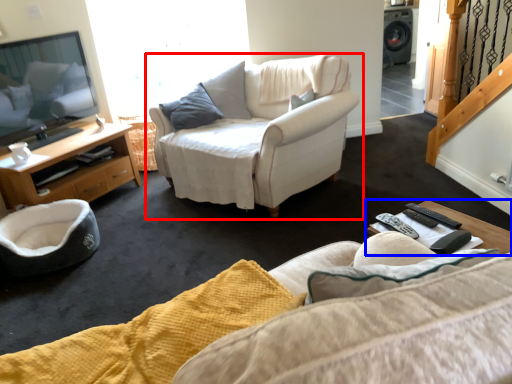
Question: Which object is further to the camera taking this photo, chair (highlighted by a red box) or coffee table (highlighted by a blue box)?

Choices:
 (A) chair
 (B) coffee table

Answer: (A)